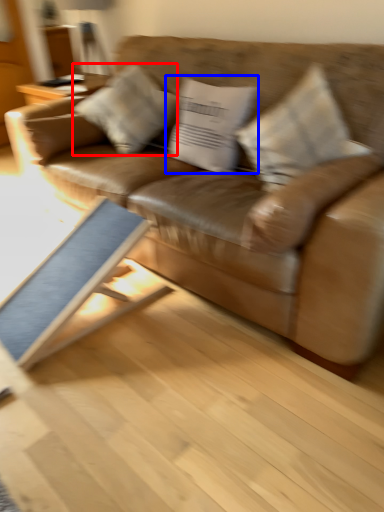
Question: Which object appears farthest to the camera in this image, pillow (highlighted by a red box) or pillow (highlighted by a blue box)?

Choices:
 (A) pillow
 (B) pillow

Answer: (A)